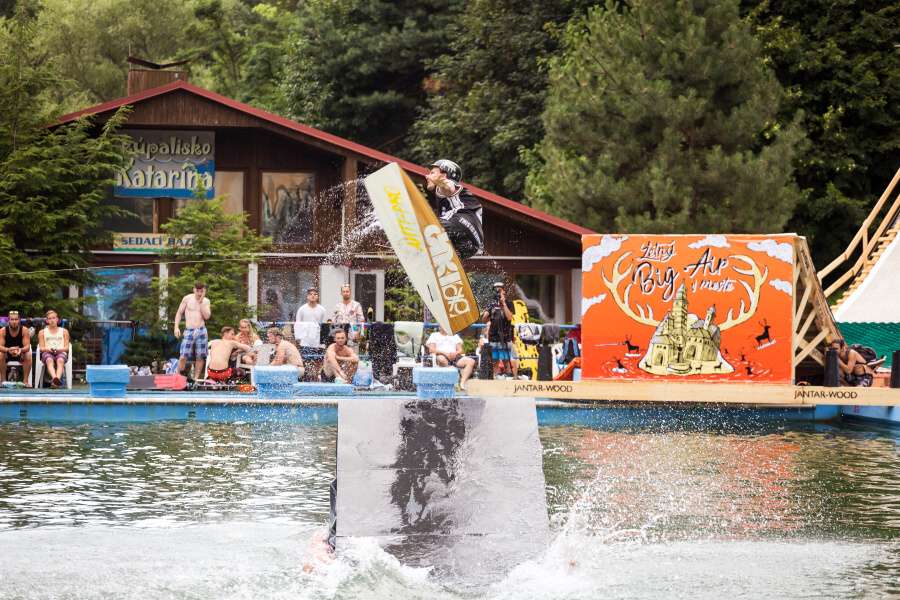
Locate an element on the screen. The width and height of the screenshot is (900, 600). white resin chair is located at coordinates (72, 366).